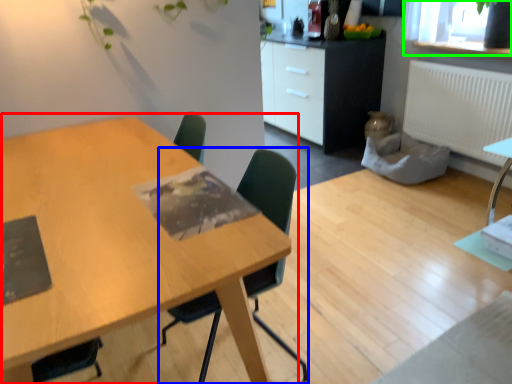
Question: Which is nearer to the table (highlighted by a red box)? chair (highlighted by a blue box) or window screen (highlighted by a green box).

Choices:
 (A) chair
 (B) window screen

Answer: (A)